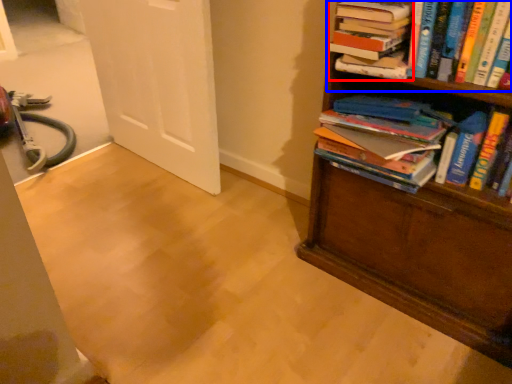
Question: Which of the following is the closest to the observer, book (highlighted by a red box) or book (highlighted by a blue box)?

Choices:
 (A) book
 (B) book

Answer: (B)